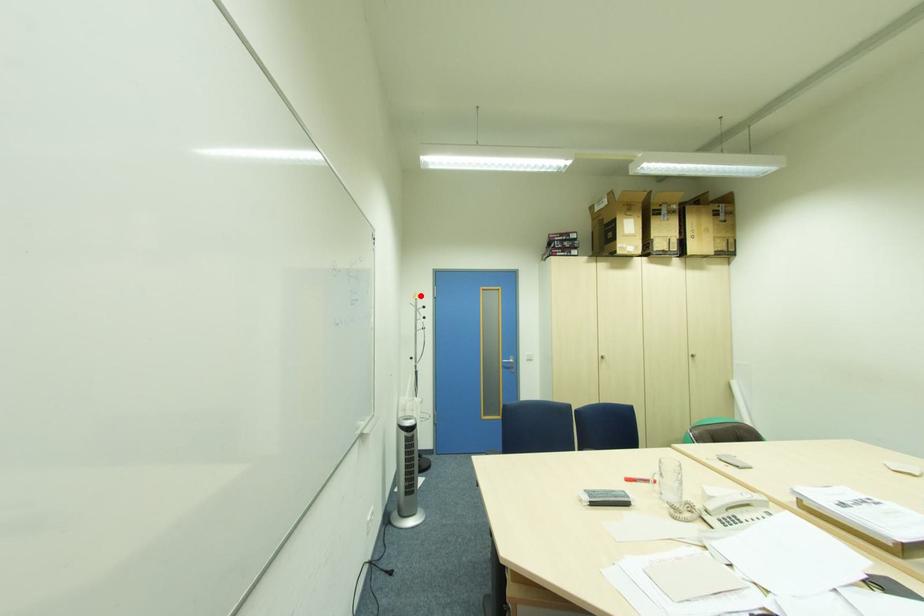
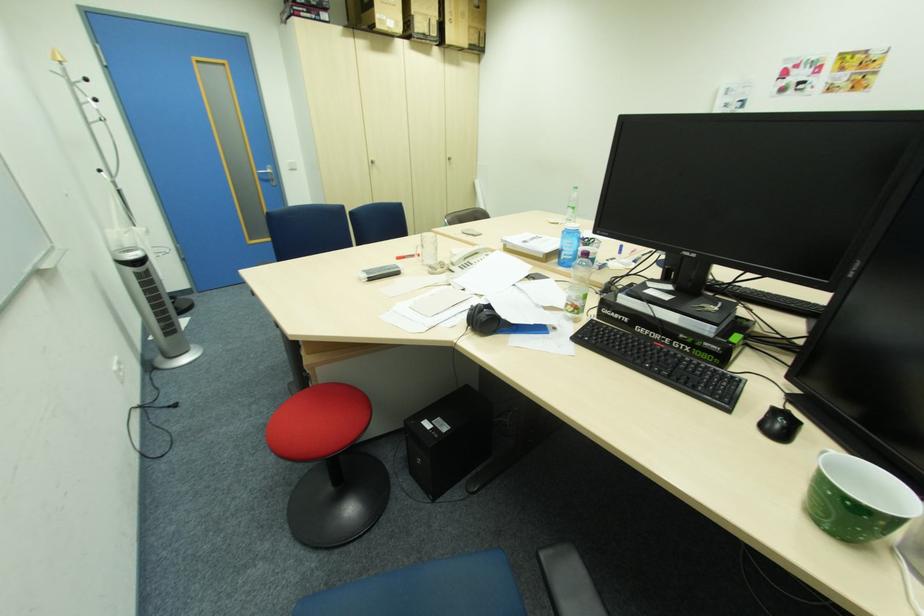
Question: I am providing you with two images of the same scene from different viewpoints. A red point is marked on the first image. Is the red point's position out of view in image 2?

Choices:
 (A) Yes
 (B) No

Answer: (B)